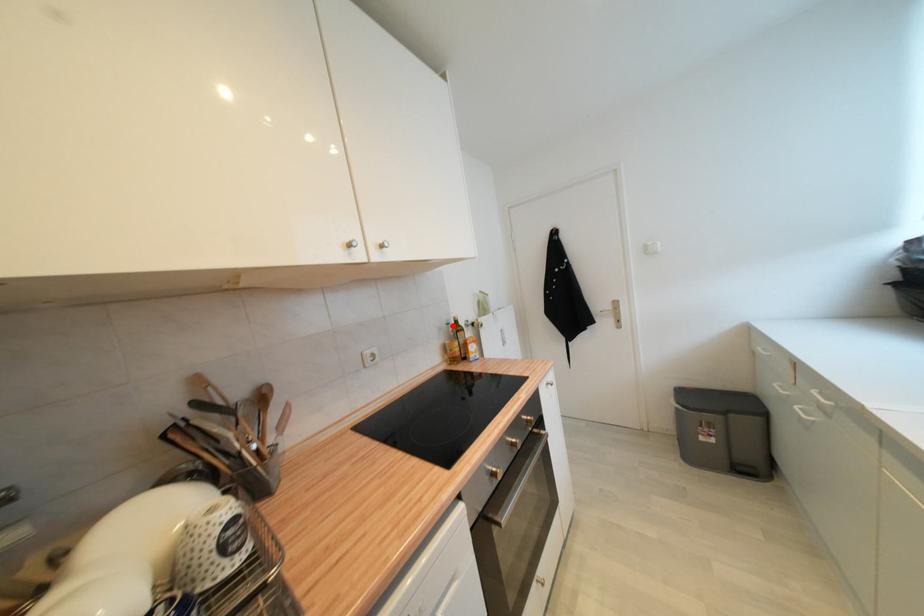
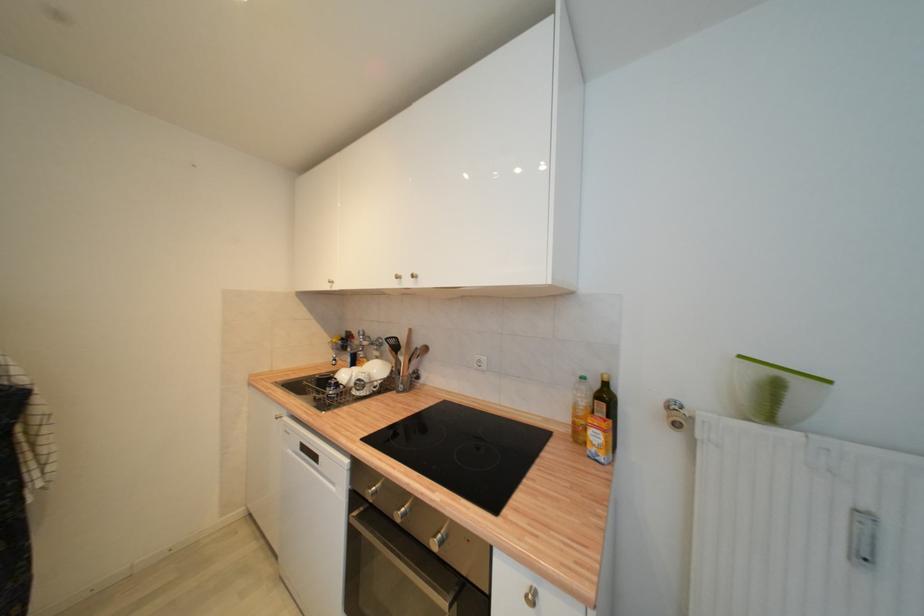
The point at the highlighted location is marked in the first image. Where is the corresponding point in the second image?

(586, 379)